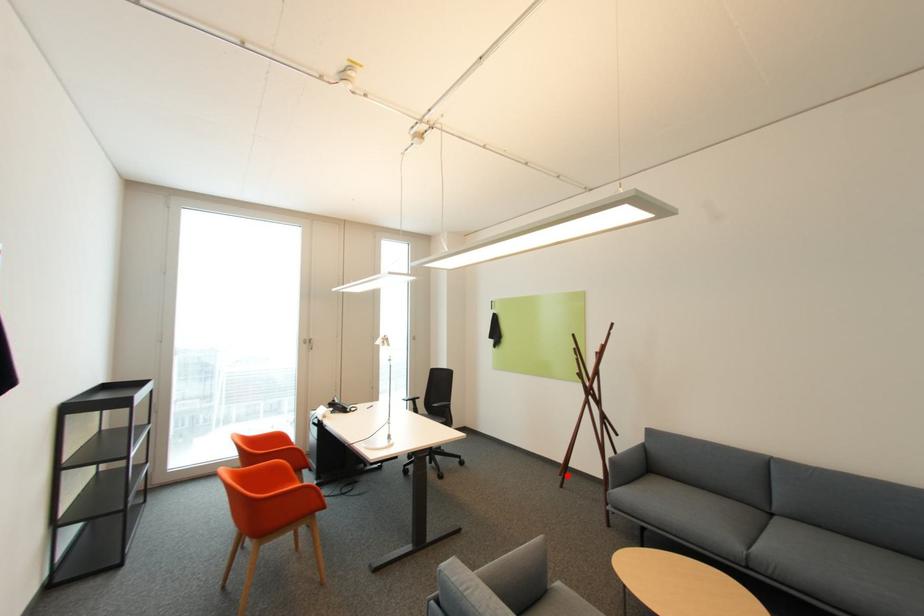
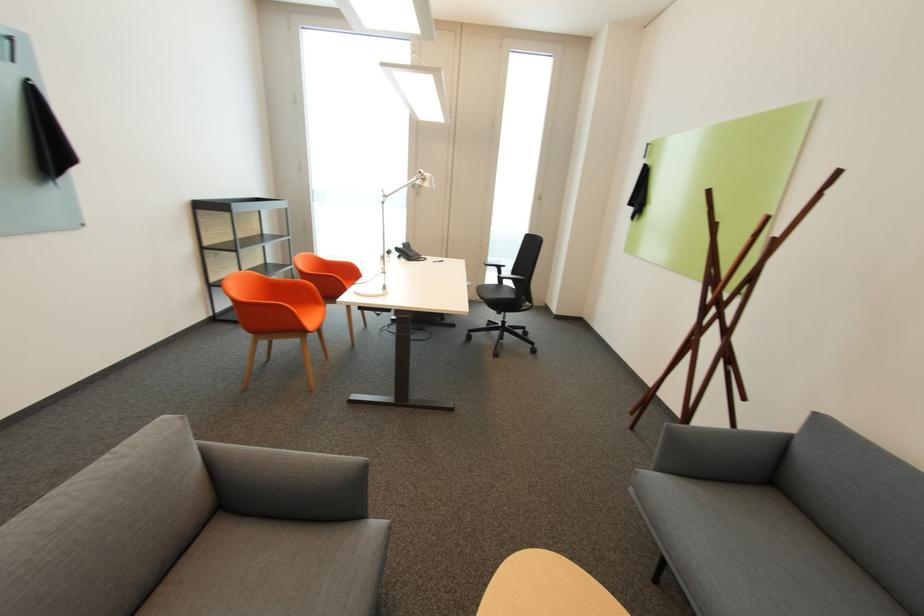
Question: I am providing you with two images of the same scene from different viewpoints. Image1 has a red point marked. In image2, the corresponding 3D location appears at what relative position? Reply with the corresponding letter.

Choices:
 (A) Closer
 (B) Farther

Answer: (A)